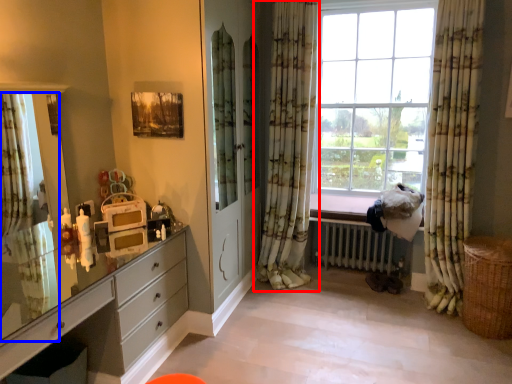
Question: Which object appears farthest to the camera in this image, curtain (highlighted by a red box) or curtain (highlighted by a blue box)?

Choices:
 (A) curtain
 (B) curtain

Answer: (A)